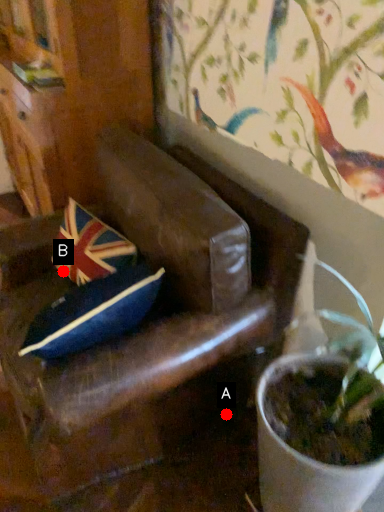
Question: Two points are circled on the image, labeled by A and B beside each circle. Which point is farther to the camera?

Choices:
 (A) A is further
 (B) B is further

Answer: (B)